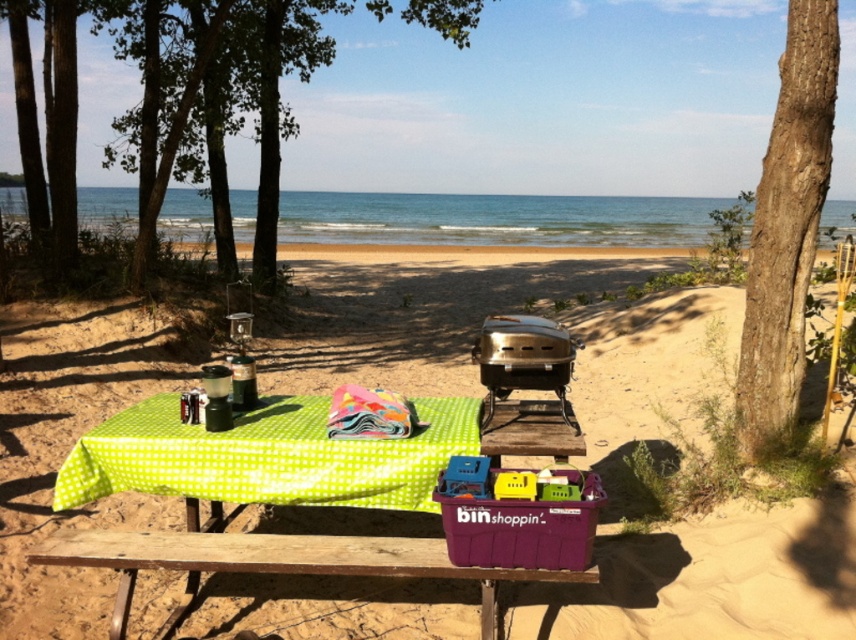
Question: Can you confirm if green checkered picnic table at center is positioned above multicolored fabric at center?

Choices:
 (A) no
 (B) yes

Answer: (A)

Question: Among these objects, which one is farthest from the camera?

Choices:
 (A) multicolored fabric at center
 (B) green checkered tablecloth at lower center

Answer: (A)

Question: Which of the following is the closest to the observer?

Choices:
 (A) green checkered tablecloth at lower center
 (B) green leafy tree at left
 (C) brown rough bark tree at right

Answer: (A)

Question: Does green checkered tablecloth at lower center appear over green leafy tree at left?

Choices:
 (A) no
 (B) yes

Answer: (A)

Question: Among these objects, which one is nearest to the camera?

Choices:
 (A) green checkered picnic table at center
 (B) green leafy tree at left
 (C) multicolored fabric at center

Answer: (A)

Question: Is green checkered picnic table at center closer to the viewer compared to green leafy tree at left?

Choices:
 (A) yes
 (B) no

Answer: (A)